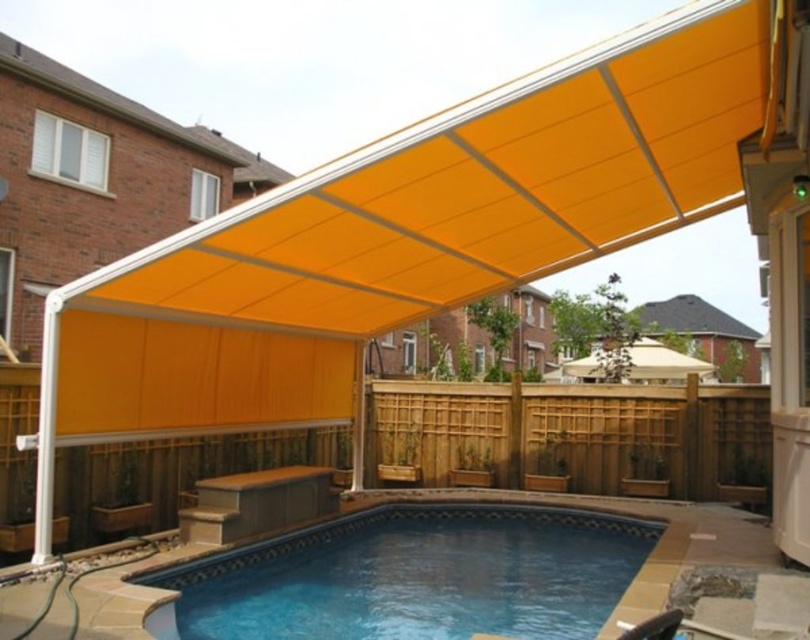
Is the position of blue tile swimming pool at center less distant than that of orange fabric awning at center?

No, it is not.

Which is behind, point (297, 563) or point (243, 417)?

Positioned behind is point (243, 417).

In order to click on blue tile swimming pool at center in this screenshot , I will do `click(416, 576)`.